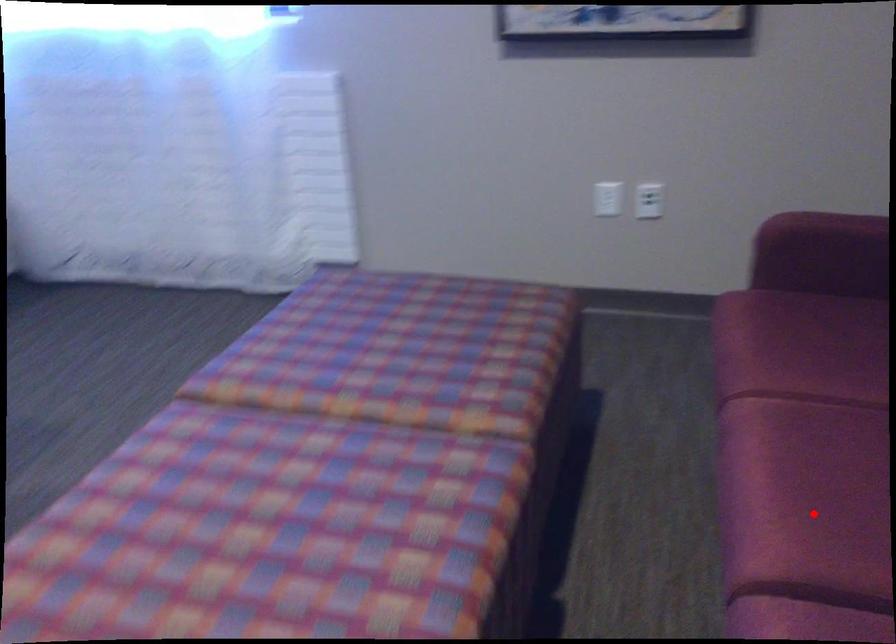
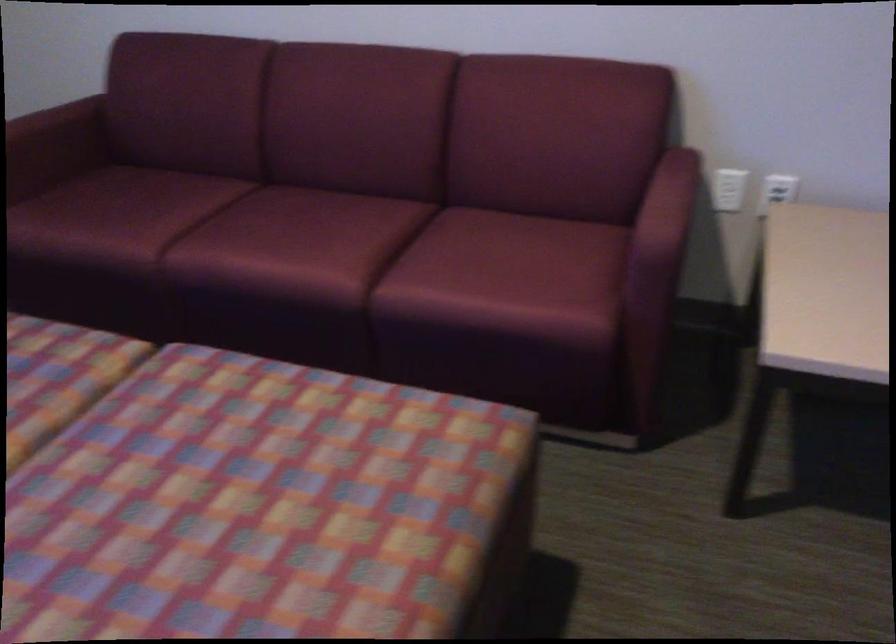
Question: I am providing you with two images of the same scene from different viewpoints. In image1, a red point is highlighted. Considering the same 3D point in image2, which of the following is correct?

Choices:
 (A) It is closer
 (B) It is farther

Answer: (B)